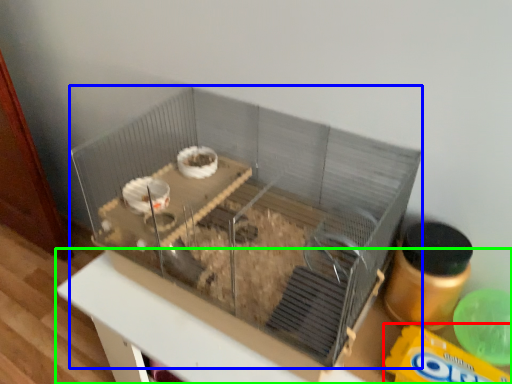
Question: Which is farther away from cereal (highlighted by a red box)? glass box (highlighted by a blue box) or table (highlighted by a green box)?

Choices:
 (A) glass box
 (B) table

Answer: (A)